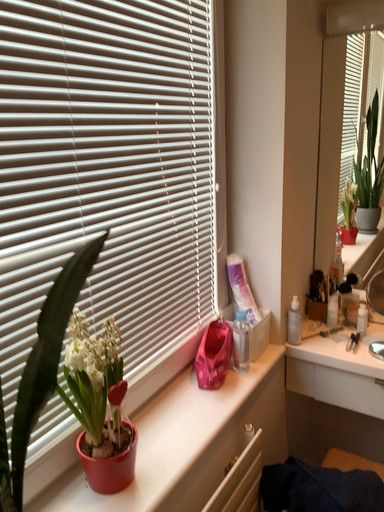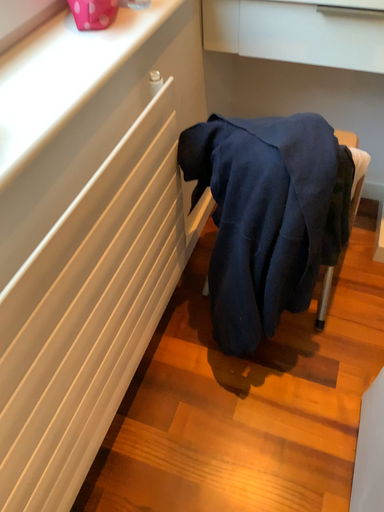
Question: How did the camera likely rotate when shooting the video?

Choices:
 (A) rotated downward
 (B) rotated upward

Answer: (A)